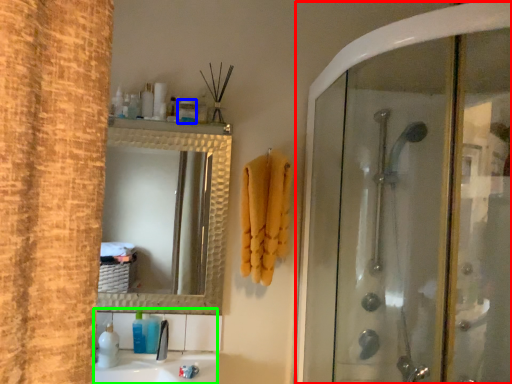
Question: Which object is positioned closest to screen door (highlighted by a red box)? Select from toiletry (highlighted by a blue box) and sink (highlighted by a green box).

Choices:
 (A) toiletry
 (B) sink

Answer: (B)